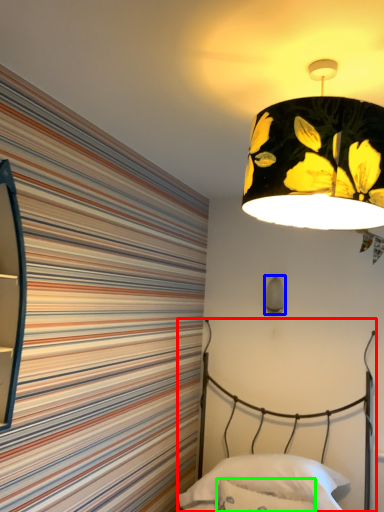
Question: Estimate the real-world distances between objects in this image. Which object is farther from bed (highlighted by a red box), lamp (highlighted by a blue box) or throw pillow (highlighted by a green box)?

Choices:
 (A) lamp
 (B) throw pillow

Answer: (A)